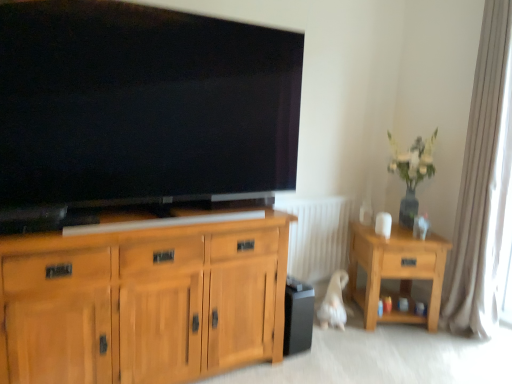
Question: Is light oak wooden side table at right looking in the opposite direction of white fabric curtain at right?

Choices:
 (A) no
 (B) yes

Answer: (A)

Question: Can you confirm if light oak wooden side table at right is smaller than white fabric curtain at right?

Choices:
 (A) no
 (B) yes

Answer: (A)

Question: Can you confirm if light oak wooden side table at right is shorter than white fabric curtain at right?

Choices:
 (A) no
 (B) yes

Answer: (B)

Question: From the image's perspective, is light oak wooden side table at right below white fabric curtain at right?

Choices:
 (A) no
 (B) yes

Answer: (B)

Question: From the image's perspective, does light oak wooden side table at right appear higher than white fabric curtain at right?

Choices:
 (A) yes
 (B) no

Answer: (B)

Question: Is light oak wooden side table at right spatially inside green glossy vase at upper right, or outside of it?

Choices:
 (A) outside
 (B) inside

Answer: (A)

Question: Considering the positions of light oak wooden side table at right and green glossy vase at upper right in the image, is light oak wooden side table at right bigger or smaller than green glossy vase at upper right?

Choices:
 (A) big
 (B) small

Answer: (A)

Question: In the image, is light oak wooden side table at right positioned in front of or behind green glossy vase at upper right?

Choices:
 (A) behind
 (B) front

Answer: (B)

Question: Considering the positions of light oak wooden side table at right and green glossy vase at upper right in the image, is light oak wooden side table at right wider or thinner than green glossy vase at upper right?

Choices:
 (A) wide
 (B) thin

Answer: (A)

Question: Considering the positions of white plastic radiator at center and black matte speaker at lower center in the image, is white plastic radiator at center wider or thinner than black matte speaker at lower center?

Choices:
 (A) wide
 (B) thin

Answer: (B)

Question: Is white plastic radiator at center to the left or to the right of black matte speaker at lower center in the image?

Choices:
 (A) left
 (B) right

Answer: (B)

Question: Choose the correct answer: Is white plastic radiator at center inside black matte speaker at lower center or outside it?

Choices:
 (A) inside
 (B) outside

Answer: (B)

Question: Is point (323, 206) closer or farther from the camera than point (304, 331)?

Choices:
 (A) closer
 (B) farther

Answer: (B)

Question: Considering the positions of black glossy tv at upper center and light oak wooden side table at right in the image, is black glossy tv at upper center taller or shorter than light oak wooden side table at right?

Choices:
 (A) short
 (B) tall

Answer: (B)

Question: From the image's perspective, relative to light oak wooden side table at right, is black glossy tv at upper center above or below?

Choices:
 (A) below
 (B) above

Answer: (B)